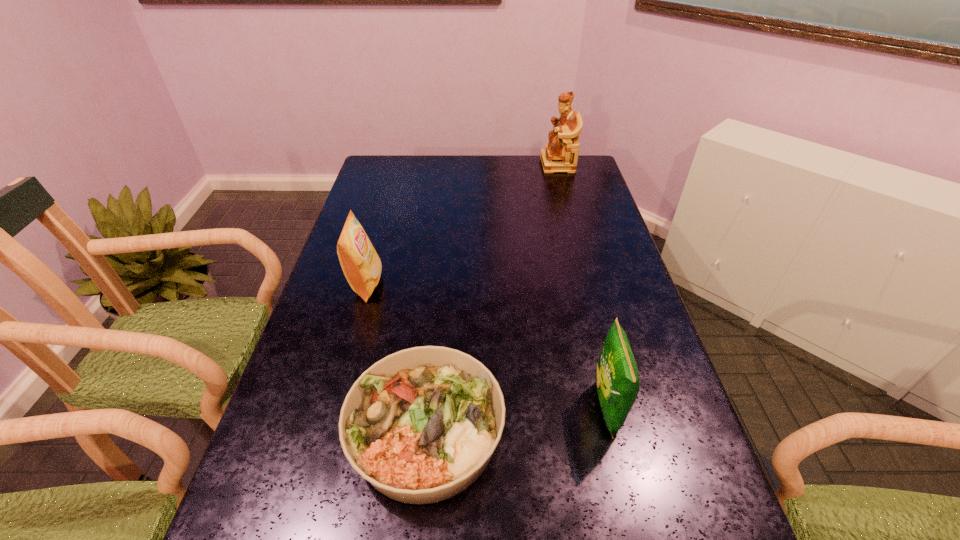
You are a GUI agent. You are given a task and a screenshot of the screen. Output one action in this format:
    pyautogui.click(x=<x>, y=<y>)
    Task: Click on the vacant space in between the nearer crisp (potato chip) and the shortest object
    
    Given the screenshot: What is the action you would take?
    pyautogui.click(x=516, y=420)

Find the location of a particular element. This screenshot has height=540, width=960. free space between the shortest object and the right crisp (potato chip) is located at coordinates (516, 420).

Locate which object ranks second in proximity to the figurine. Please provide its 2D coordinates. Your answer should be formatted as a tuple, i.e. [(x, y)], where the tuple contains the x and y coordinates of a point satisfying the conditions above.

[(420, 425)]

Where is `object that is the closest to the figurine`? The height and width of the screenshot is (540, 960). object that is the closest to the figurine is located at coordinates (361, 265).

The image size is (960, 540). What are the coordinates of `vacant region that satisfies the following two spatial constraints: 1. on the front-facing side of the farther crisp (potato chip); 2. on the back side of the shortest object` in the screenshot? It's located at (324, 432).

The width and height of the screenshot is (960, 540). What are the coordinates of `free space in the image that satisfies the following two spatial constraints: 1. on the back side of the shortest object; 2. on the front-facing side of the leftmost object` in the screenshot? It's located at (441, 284).

Locate an element on the screen. The image size is (960, 540). free space in the image that satisfies the following two spatial constraints: 1. on the front-facing side of the nearer crisp (potato chip); 2. on the front side of the salad plate is located at coordinates (612, 432).

This screenshot has width=960, height=540. What are the coordinates of `free space that satisfies the following two spatial constraints: 1. on the front-facing side of the third nearest object; 2. on the back side of the third object from right to left` in the screenshot? It's located at (324, 432).

This screenshot has height=540, width=960. Find the location of `vacant space that satisfies the following two spatial constraints: 1. on the front-facing side of the shortest object; 2. on the right side of the farther crisp (potato chip)`. vacant space that satisfies the following two spatial constraints: 1. on the front-facing side of the shortest object; 2. on the right side of the farther crisp (potato chip) is located at coordinates (324, 432).

Find the location of a particular element. vacant area that satisfies the following two spatial constraints: 1. on the front-facing side of the third nearest object; 2. on the left side of the salad plate is located at coordinates (324, 432).